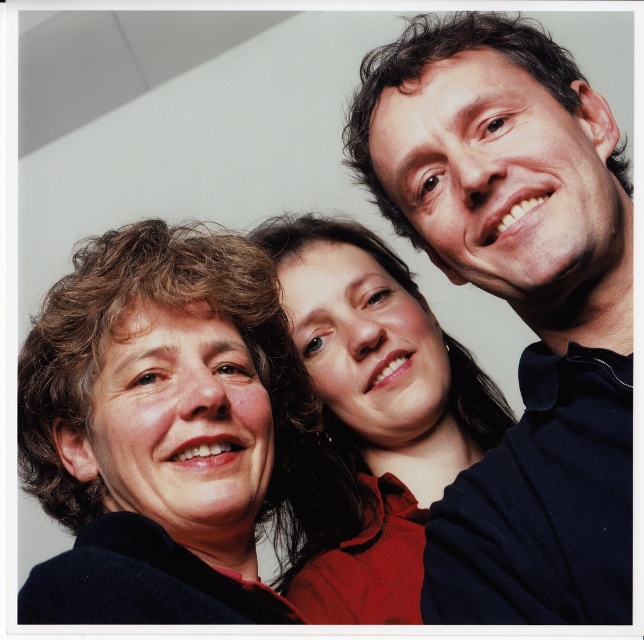
You are standing 30 inches away from the image. Can you reach the point at coordinates point (560, 323) without moving closer?

The point at coordinates point (560, 323) is 28.36 inches away from the viewer. Since you are standing 30 inches away, you can reach it without moving closer.

You are a photographer adjusting the lighting for a group photo. You have a spotlight that can cover an area of 10 inches in diameter. The subjects are the matte black jacket at left and the smooth red shirt at center. Can the spotlight illuminate both subjects simultaneously?

The distance between the matte black jacket at left and the smooth red shirt at center is 7.53 inches. Since the spotlight can cover 10 inches, which is wider than the distance between them, both subjects can be illuminated simultaneously.

You are a photographer adjusting the focus on your camera. You notice two points in the image at coordinates point (600, 541) and point (231, 257). Which point should you focus on first if you want to ensure the closest object is sharp?

Point (600, 541) is closer to the viewer than point (231, 257), so you should focus on point (600, 541) first to ensure the closest object is sharp.